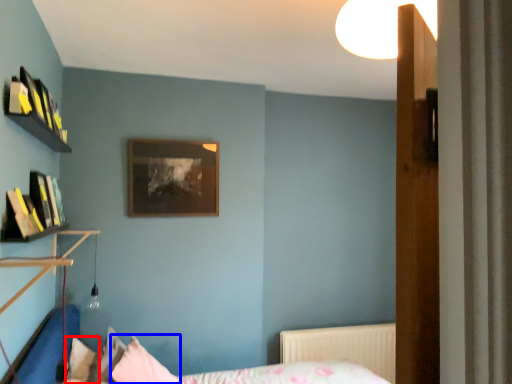
Question: Which point is closer to the camera, pillow (highlighted by a red box) or pillow (highlighted by a blue box)?

Choices:
 (A) pillow
 (B) pillow

Answer: (B)